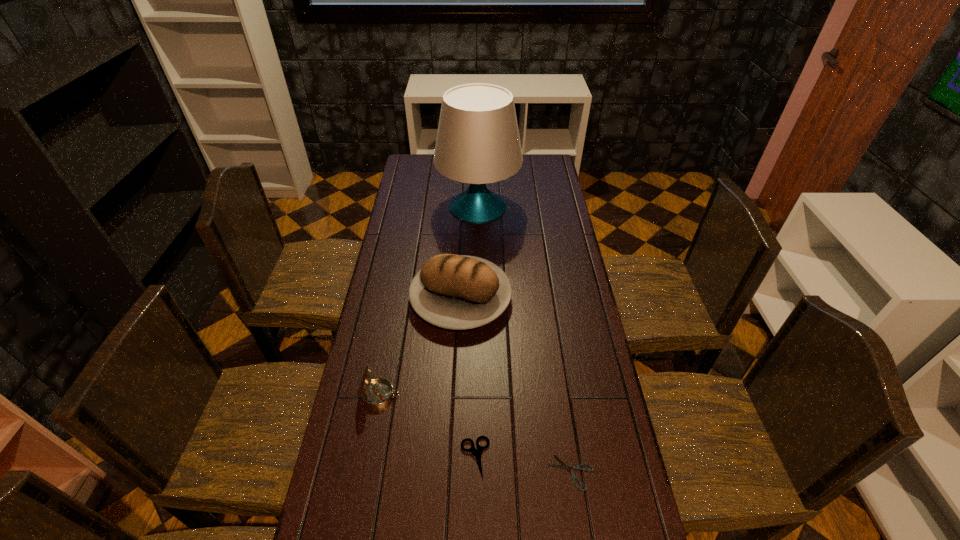
Locate an element on the screen. The image size is (960, 540). free space between the fourth nearest object and the third nearest object is located at coordinates (420, 347).

Image resolution: width=960 pixels, height=540 pixels. Find the location of `vacant area that lies between the bread and the shortest object`. vacant area that lies between the bread and the shortest object is located at coordinates (516, 385).

Find the location of `free space between the table lamp and the shortest object`. free space between the table lamp and the shortest object is located at coordinates (525, 339).

Locate an element on the screen. free space between the second tallest object and the shorter shears is located at coordinates (516, 385).

Locate an element on the screen. The image size is (960, 540). unoccupied position between the shorter shears and the compass is located at coordinates (475, 434).

The image size is (960, 540). I want to click on empty space between the table lamp and the taller shears, so click(x=477, y=332).

This screenshot has width=960, height=540. In order to click on vacant space that is in between the left shears and the right shears in this screenshot , I will do `click(523, 465)`.

Where is `free space between the fourth shortest object and the left shears`? The width and height of the screenshot is (960, 540). free space between the fourth shortest object and the left shears is located at coordinates (468, 378).

Identify the location of free spot between the second tallest object and the table lamp. This screenshot has width=960, height=540. (469, 253).

Select which object appears as the third closest to the second tallest object. Please provide its 2D coordinates. Your answer should be formatted as a tuple, i.e. [(x, y)], where the tuple contains the x and y coordinates of a point satisfying the conditions above.

[(477, 453)]